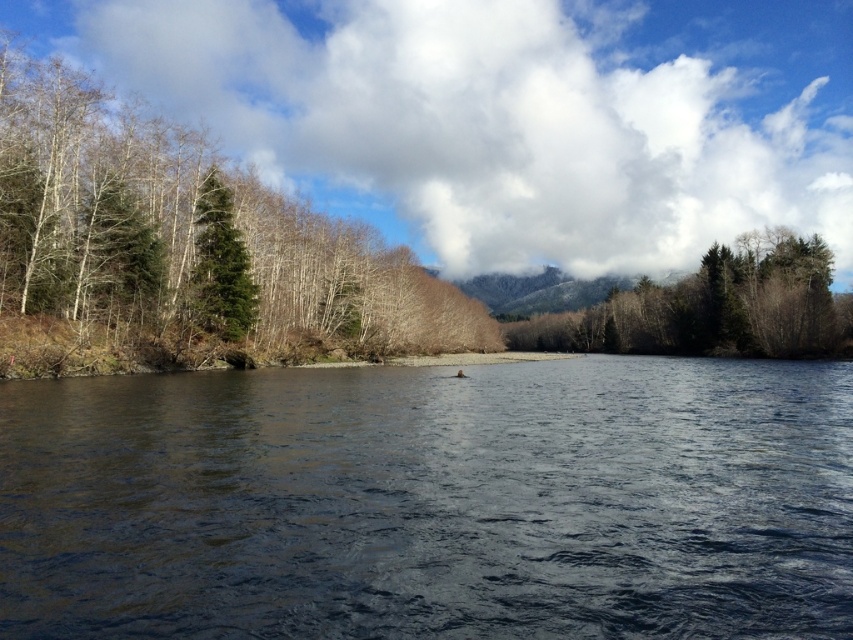
You are standing on a path near the river and want to cross to the other side. The dark water at center and green matte trees at center are in your way. Which one do you need to navigate around to reach the opposite bank?

You need to navigate around the dark water at center because it is wider than the green matte trees at center, making it the larger obstacle to cross the river.

You are standing at the edge of the river and see two points in the image. One is at point (585,186) and the other is at point (225,339). Which point is closer to your current position?

Point (585,186) is further to the camera than point (225,339), so the point closer to your current position is point (225,339).

You are a hiker standing on the trail near the river. You want to cross the river to reach the trees on the other side. Based on the scene, which direction should you head to cross the river first between the dark water at center and the green matte trees at center?

You should head towards the dark water at center first since it is located to the left of the green matte trees at center, meaning the river is positioned before the trees when moving towards them.